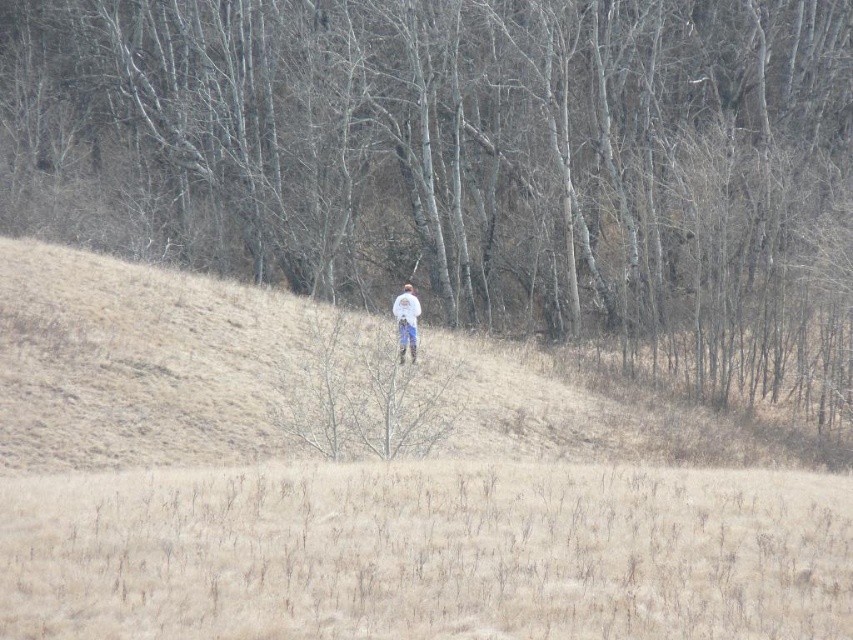
You are a hiker trying to reach the dense cluster of trees in the middle ground. You see a brown bark tree at center and dry grass at center. Which object is closer to you, the hiker, as you walk towards the dense cluster of trees?

The brown bark tree at center is closer to you than the dry grass at center, so you will encounter the brown bark tree at center first.

You are a hiker trying to navigate through the field. You notice the brown bark tree at center and the dry grass at center. Which one is wider in terms of their spread?

The brown bark tree at center is wider than the dry grass at center.